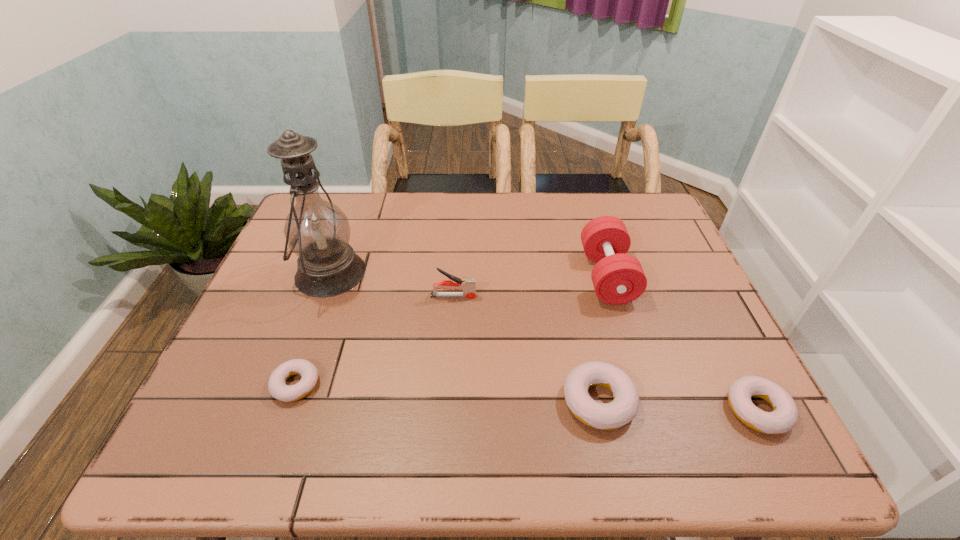
The height and width of the screenshot is (540, 960). What are the coordinates of `object that is at the near right corner` in the screenshot? It's located at (784, 416).

Where is `vacant space at the far edge of the desktop`? The height and width of the screenshot is (540, 960). vacant space at the far edge of the desktop is located at coordinates (379, 202).

This screenshot has height=540, width=960. Identify the location of vacant space at the near edge. (650, 385).

This screenshot has width=960, height=540. In order to click on free space at the left edge in this screenshot , I will do `click(281, 267)`.

Find the location of `vacant area at the right edge`. vacant area at the right edge is located at coordinates (x=718, y=370).

Find the location of a particular element. This screenshot has height=540, width=960. vacant area at the far left corner of the desktop is located at coordinates (336, 199).

The height and width of the screenshot is (540, 960). In order to click on vacant space at the far right corner of the desktop in this screenshot , I will do `click(632, 191)`.

Locate an element on the screen. empty location between the tallest object and the second doughnut from left to right is located at coordinates (465, 337).

This screenshot has height=540, width=960. I want to click on vacant area that lies between the tallest object and the second shortest doughnut, so click(x=544, y=341).

Image resolution: width=960 pixels, height=540 pixels. Identify the location of free space that is in between the fourth tallest object and the fifth shortest object. click(603, 339).